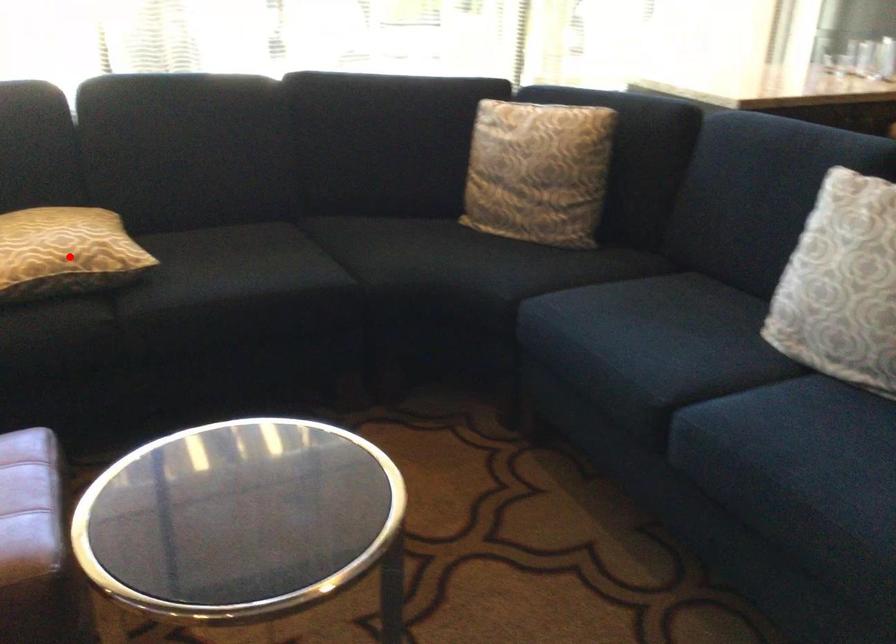
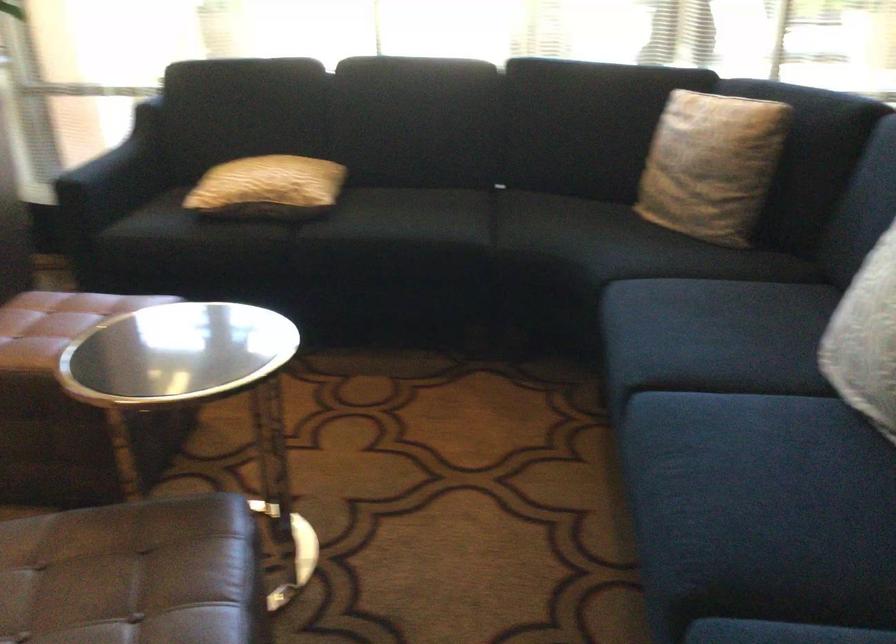
Where in the second image is the point corresponding to the highlighted location from the first image?

(268, 187)